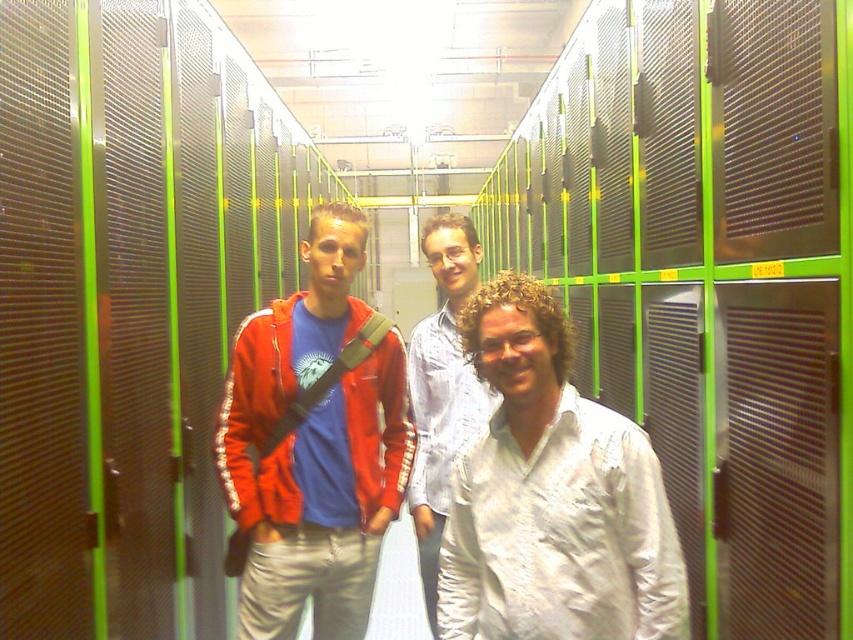
You are a security guard in the server room and need to identify the person in front. You see the white satin shirt at center and the matte red jacket at center. Which one is closer to you?

The white satin shirt at center is in front of the matte red jacket at center, so the person wearing the white satin shirt at center is closer to you.

You are a security guard in the server room and need to identify the person with the smaller clothing item. Which individual is wearing the smaller item between the matte red jacket at center and the white textured shirt at center?

The matte red jacket at center is smaller than the white textured shirt at center, so the individual wearing the matte red jacket at center has the smaller clothing item.

You are a security guard in the server room. You need to identify which of the two people wearing the matte red jacket at center or the white textured shirt at center is shorter. Which one is shorter?

The matte red jacket at center is shorter than the white textured shirt at center, so the person wearing the matte red jacket at center is shorter.